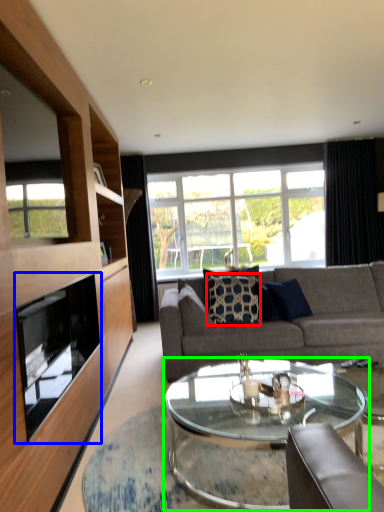
Question: Based on their relative distances, which object is farther from pillow (highlighted by a red box)? Choose from fireplace (highlighted by a blue box) and coffee table (highlighted by a green box).

Choices:
 (A) fireplace
 (B) coffee table

Answer: (A)